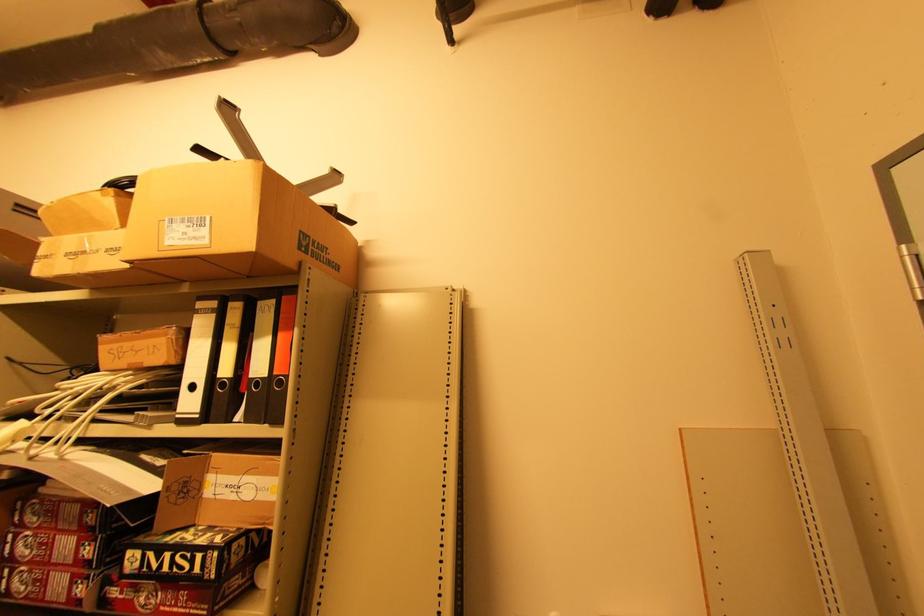
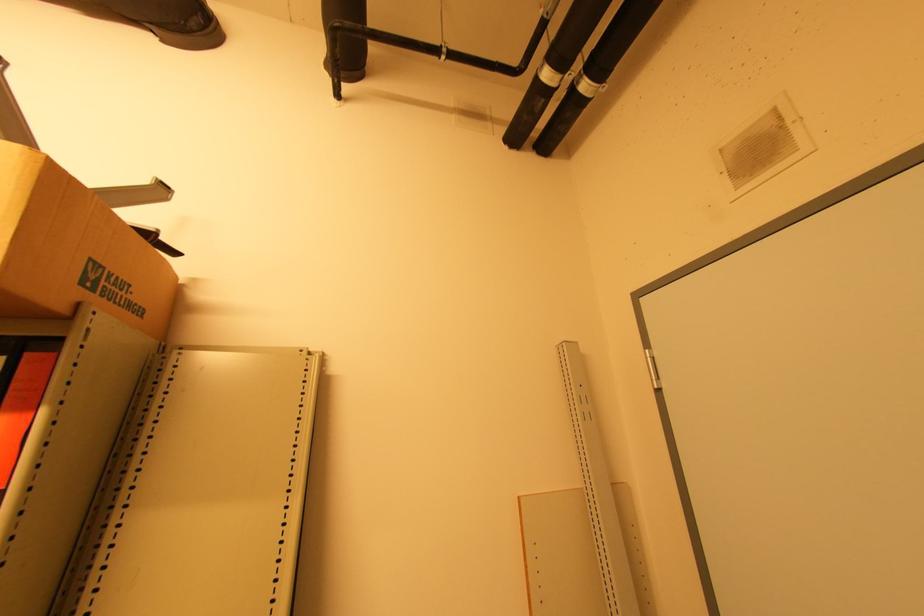
Question: How did the camera likely rotate?

Choices:
 (A) Left
 (B) Right
 (C) Up
 (D) Down

Answer: (B)